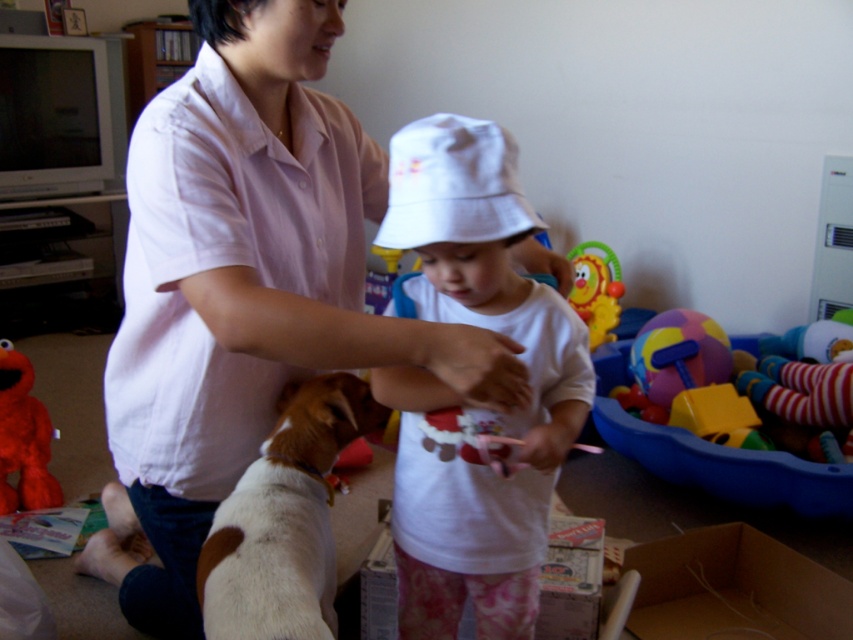
Question: Where is brown and white fur at lower left located in relation to fluffy plush toy at left in the image?

Choices:
 (A) below
 (B) above

Answer: (A)

Question: Considering the relative positions of brown and white fur at lower left and plastic yellow lion at center in the image provided, where is brown and white fur at lower left located with respect to plastic yellow lion at center?

Choices:
 (A) left
 (B) right

Answer: (A)

Question: Estimate the real-world distances between objects in this image. Which object is closer to the matte pink shirt at center?

Choices:
 (A) plastic yellow lion at center
 (B) fluffy plush toy at left
 (C) brown and white fur at lower left
 (D) white cotton hat at center

Answer: (C)

Question: Estimate the real-world distances between objects in this image. Which object is farther from the matte pink shirt at center?

Choices:
 (A) plastic yellow lion at center
 (B) brown and white fur at lower left

Answer: (A)

Question: Can you confirm if white cotton hat at center is wider than brown and white fur at lower left?

Choices:
 (A) yes
 (B) no

Answer: (A)

Question: Which of the following is the farthest from the observer?

Choices:
 (A) white cotton hat at center
 (B) plastic yellow lion at center
 (C) matte pink shirt at center
 (D) brown and white fur at lower left

Answer: (B)